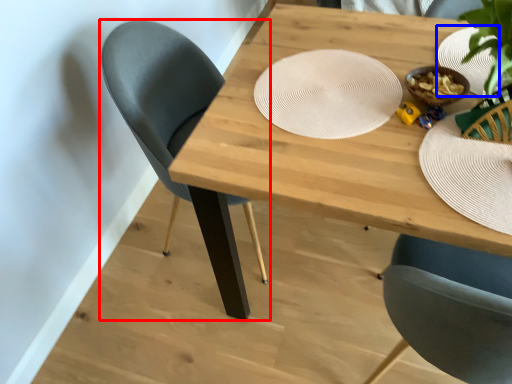
Question: Which object is further to the camera taking this photo, chair (highlighted by a red box) or paper plate (highlighted by a blue box)?

Choices:
 (A) chair
 (B) paper plate

Answer: (A)